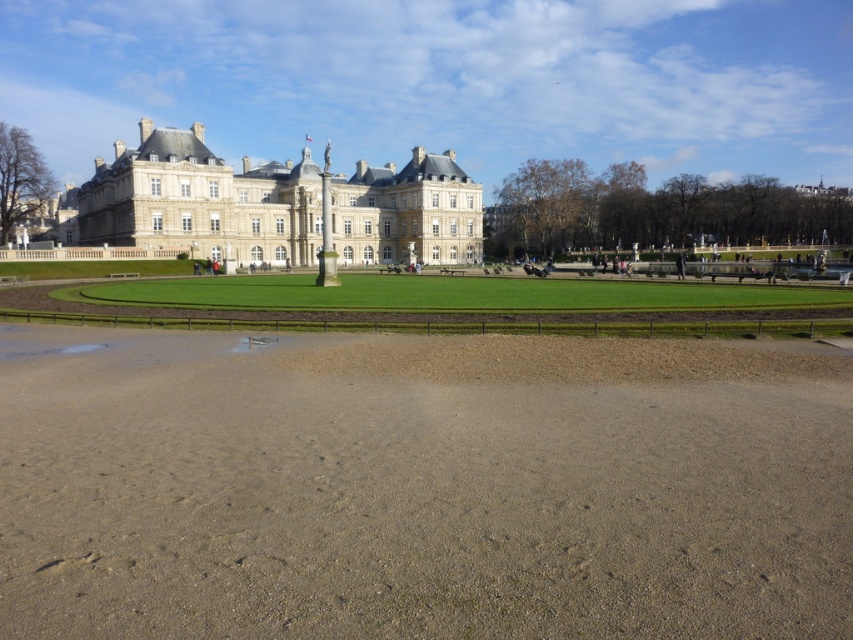
Question: Can you confirm if green grass at center is wider than white stone building at center?

Choices:
 (A) no
 (B) yes

Answer: (A)

Question: Is green grass at center closer to the viewer compared to white stone building at center?

Choices:
 (A) yes
 (B) no

Answer: (A)

Question: Can you confirm if green grass at center is positioned below white stone building at center?

Choices:
 (A) no
 (B) yes

Answer: (B)